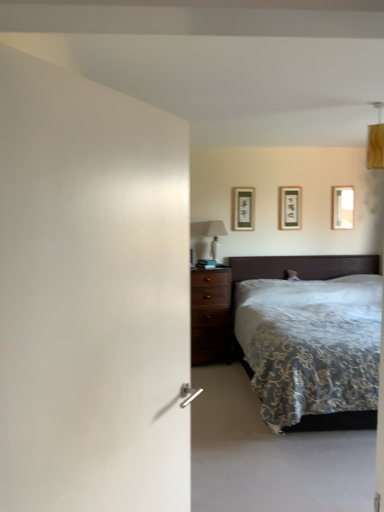
In order to face white glossy table lamp at upper center, should I rotate leftwards or rightwards?

Rotate right and turn 3.295 degrees.

Where is `white glossy table lamp at upper center`? white glossy table lamp at upper center is located at coordinates (210, 233).

Find the location of a particular element. Image resolution: width=384 pixels, height=512 pixels. wooden picture frame at upper right, acting as the first picture frame starting from the right is located at coordinates (342, 207).

Describe the element at coordinates (290, 208) in the screenshot. The image size is (384, 512). I see `matte black picture frame at upper center, the second picture frame in the left-to-right sequence` at that location.

This screenshot has width=384, height=512. What do you see at coordinates (297, 274) in the screenshot? I see `velvet dark brown bed at right` at bounding box center [297, 274].

This screenshot has height=512, width=384. What are the coordinates of `white glossy table lamp at upper center` in the screenshot? It's located at (210, 233).

Which is correct: matte black picture frame at upper center, the second picture frame in the left-to-right sequence, is inside matte black picture frame at upper center, the third picture frame in the right-to-left sequence, or outside of it?

matte black picture frame at upper center, the second picture frame in the left-to-right sequence, exists outside the volume of matte black picture frame at upper center, the third picture frame in the right-to-left sequence.

From the image's perspective, relative to matte black picture frame at upper center, which ranks as the first picture frame in left-to-right order, is matte black picture frame at upper center, the second picture frame in the left-to-right sequence, above or below?

Clearly, from the image's perspective, matte black picture frame at upper center, the second picture frame in the left-to-right sequence, is above matte black picture frame at upper center, which ranks as the first picture frame in left-to-right order.

Is matte black picture frame at upper center, the 2th picture frame positioned from the right, not near matte black picture frame at upper center, the third picture frame in the right-to-left sequence?

Actually, matte black picture frame at upper center, the 2th picture frame positioned from the right, and matte black picture frame at upper center, the third picture frame in the right-to-left sequence, are a little close together.

From a real-world perspective, which is physically above, matte black picture frame at upper center, the second picture frame in the left-to-right sequence, or matte black picture frame at upper center, the third picture frame in the right-to-left sequence?

matte black picture frame at upper center, the third picture frame in the right-to-left sequence, from a real-world perspective.

From the picture: Which object is thinner, wooden picture frame at upper right, which is counted as the 3th picture frame, starting from the left, or matte black picture frame at upper center, the third picture frame in the right-to-left sequence?

Thinner between the two is wooden picture frame at upper right, which is counted as the 3th picture frame, starting from the left.

Find the location of a particular element. This screenshot has width=384, height=512. the 2nd picture frame to the right of the matte black picture frame at upper center, the third picture frame in the right-to-left sequence, starting your count from the anchor is located at coordinates click(x=342, y=207).

Considering the sizes of objects wooden picture frame at upper right, which is counted as the 3th picture frame, starting from the left, and matte black picture frame at upper center, the third picture frame in the right-to-left sequence, in the image provided, who is bigger, wooden picture frame at upper right, which is counted as the 3th picture frame, starting from the left, or matte black picture frame at upper center, the third picture frame in the right-to-left sequence,?

matte black picture frame at upper center, the third picture frame in the right-to-left sequence, is bigger.

At what (x,y) coordinates should I click in order to perform the action: click on picture frame that is the 1st one when counting leftward from the velvet dark brown bed at right. Please return your answer as a coordinate pair (x, y). Image resolution: width=384 pixels, height=512 pixels. Looking at the image, I should click on (290, 208).

Is velvet dark brown bed at right far away from matte black picture frame at upper center, the 2th picture frame positioned from the right?

No, velvet dark brown bed at right is in close proximity to matte black picture frame at upper center, the 2th picture frame positioned from the right.

Which is in front, point (379, 259) or point (283, 210)?

The point (283, 210) is more forward.

Is velvet dark brown bed at right positioned with its back to matte black picture frame at upper center, the 2th picture frame positioned from the right?

No, velvet dark brown bed at right's orientation is not away from matte black picture frame at upper center, the 2th picture frame positioned from the right.

From the image's perspective, does matte black picture frame at upper center, the third picture frame in the right-to-left sequence, appear lower than wooden picture frame at upper right, which is counted as the 3th picture frame, starting from the left?

Yes, from the image's perspective, matte black picture frame at upper center, the third picture frame in the right-to-left sequence, is beneath wooden picture frame at upper right, which is counted as the 3th picture frame, starting from the left.

Based on their sizes in the image, would you say matte black picture frame at upper center, the third picture frame in the right-to-left sequence, is bigger or smaller than wooden picture frame at upper right, acting as the first picture frame starting from the right?

Considering their sizes, matte black picture frame at upper center, the third picture frame in the right-to-left sequence, takes up more space than wooden picture frame at upper right, acting as the first picture frame starting from the right.

Would you say matte black picture frame at upper center, which ranks as the first picture frame in left-to-right order, is inside or outside wooden picture frame at upper right, acting as the first picture frame starting from the right?

matte black picture frame at upper center, which ranks as the first picture frame in left-to-right order, is not enclosed by wooden picture frame at upper right, acting as the first picture frame starting from the right.

Relative to wooden picture frame at upper right, acting as the first picture frame starting from the right, is matte black picture frame at upper center, the third picture frame in the right-to-left sequence, in front or behind?

Visually, matte black picture frame at upper center, the third picture frame in the right-to-left sequence, is located in front of wooden picture frame at upper right, acting as the first picture frame starting from the right.

Is matte black picture frame at upper center, the third picture frame in the right-to-left sequence, to the left of matte black picture frame at upper center, the second picture frame in the left-to-right sequence, from the viewer's perspective?

Yes.

Is matte black picture frame at upper center, the third picture frame in the right-to-left sequence, spatially inside matte black picture frame at upper center, the 2th picture frame positioned from the right, or outside of it?

matte black picture frame at upper center, the third picture frame in the right-to-left sequence, is not enclosed by matte black picture frame at upper center, the 2th picture frame positioned from the right.

Is matte black picture frame at upper center, the third picture frame in the right-to-left sequence, turned away from matte black picture frame at upper center, the second picture frame in the left-to-right sequence?

No, matte black picture frame at upper center, the second picture frame in the left-to-right sequence, is not at the back of matte black picture frame at upper center, the third picture frame in the right-to-left sequence.

From the image's perspective, is matte black picture frame at upper center, which ranks as the first picture frame in left-to-right order, positioned above or below matte black picture frame at upper center, the 2th picture frame positioned from the right?

matte black picture frame at upper center, which ranks as the first picture frame in left-to-right order, is situated lower than matte black picture frame at upper center, the 2th picture frame positioned from the right, in the image.

How different are the orientations of matte black picture frame at upper center, the third picture frame in the right-to-left sequence, and velvet dark brown bed at right in degrees?

The angular difference between matte black picture frame at upper center, the third picture frame in the right-to-left sequence, and velvet dark brown bed at right is 0.00781 degrees.

Which object is closer to the camera, matte black picture frame at upper center, the third picture frame in the right-to-left sequence, or velvet dark brown bed at right?

velvet dark brown bed at right.

In order to click on bed to the right of matte black picture frame at upper center, the third picture frame in the right-to-left sequence in this screenshot , I will do `click(297, 274)`.

Between white glossy table lamp at upper center and matte black picture frame at upper center, which ranks as the first picture frame in left-to-right order, which one has smaller width?

With smaller width is matte black picture frame at upper center, which ranks as the first picture frame in left-to-right order.

Is white glossy table lamp at upper center positioned with its back to matte black picture frame at upper center, which ranks as the first picture frame in left-to-right order?

No, white glossy table lamp at upper center is not facing away from matte black picture frame at upper center, which ranks as the first picture frame in left-to-right order.

Can we say white glossy table lamp at upper center lies outside matte black picture frame at upper center, which ranks as the first picture frame in left-to-right order?

Indeed, white glossy table lamp at upper center is completely outside matte black picture frame at upper center, which ranks as the first picture frame in left-to-right order.

Can you confirm if white glossy table lamp at upper center is taller than matte black picture frame at upper center, which ranks as the first picture frame in left-to-right order?

Indeed, white glossy table lamp at upper center has a greater height compared to matte black picture frame at upper center, which ranks as the first picture frame in left-to-right order.

The width and height of the screenshot is (384, 512). I want to click on picture frame on the left side of matte black picture frame at upper center, the 2th picture frame positioned from the right, so click(243, 209).

At what (x,y) coordinates should I click in order to perform the action: click on the 2nd picture frame to the right when counting from the matte black picture frame at upper center, which ranks as the first picture frame in left-to-right order. Please return your answer as a coordinate pair (x, y). Image resolution: width=384 pixels, height=512 pixels. Looking at the image, I should click on (342, 207).

When comparing their distances from wooden picture frame at upper right, acting as the first picture frame starting from the right, does matte black picture frame at upper center, the second picture frame in the left-to-right sequence, or velvet dark brown bed at right seem further?

velvet dark brown bed at right.

From the image, which object appears to be farther from white glossy table lamp at upper center, matte black picture frame at upper center, the third picture frame in the right-to-left sequence, or matte black picture frame at upper center, the second picture frame in the left-to-right sequence?

matte black picture frame at upper center, the second picture frame in the left-to-right sequence.

Based on their spatial positions, is matte black picture frame at upper center, which ranks as the first picture frame in left-to-right order, or matte black picture frame at upper center, the second picture frame in the left-to-right sequence, further from wooden picture frame at upper right, acting as the first picture frame starting from the right?

Based on the image, matte black picture frame at upper center, which ranks as the first picture frame in left-to-right order, appears to be further to wooden picture frame at upper right, acting as the first picture frame starting from the right.

Based on the photo, estimate the real-world distances between objects in this image. Which object is closer to white glossy table lamp at upper center, matte black picture frame at upper center, the 2th picture frame positioned from the right, or matte black picture frame at upper center, which ranks as the first picture frame in left-to-right order?

Among the two, matte black picture frame at upper center, which ranks as the first picture frame in left-to-right order, is located nearer to white glossy table lamp at upper center.

Estimate the real-world distances between objects in this image. Which object is closer to wooden picture frame at upper right, which is counted as the 3th picture frame, starting from the left, velvet dark brown bed at right or matte black picture frame at upper center, the 2th picture frame positioned from the right?

Based on the image, matte black picture frame at upper center, the 2th picture frame positioned from the right, appears to be nearer to wooden picture frame at upper right, which is counted as the 3th picture frame, starting from the left.

Considering their positions, is matte black picture frame at upper center, which ranks as the first picture frame in left-to-right order, positioned closer to matte black picture frame at upper center, the 2th picture frame positioned from the right, than velvet dark brown bed at right?

matte black picture frame at upper center, which ranks as the first picture frame in left-to-right order, is positioned closer to the anchor matte black picture frame at upper center, the 2th picture frame positioned from the right.

Based on their spatial positions, is wooden picture frame at upper right, which is counted as the 3th picture frame, starting from the left, or velvet dark brown bed at right closer to matte black picture frame at upper center, which ranks as the first picture frame in left-to-right order?

velvet dark brown bed at right.

From the image, which object appears to be nearer to wooden picture frame at upper right, which is counted as the 3th picture frame, starting from the left, matte black picture frame at upper center, the third picture frame in the right-to-left sequence, or white glossy table lamp at upper center?

matte black picture frame at upper center, the third picture frame in the right-to-left sequence, lies closer to wooden picture frame at upper right, which is counted as the 3th picture frame, starting from the left, than the other object.

I want to click on table lamp between velvet dark brown bed at right and matte black picture frame at upper center, the second picture frame in the left-to-right sequence, along the z-axis, so click(210, 233).

In order to click on picture frame located between velvet dark brown bed at right and matte black picture frame at upper center, the second picture frame in the left-to-right sequence, in the depth direction in this screenshot , I will do `click(243, 209)`.

This screenshot has width=384, height=512. I want to click on picture frame situated between white glossy table lamp at upper center and matte black picture frame at upper center, the 2th picture frame positioned from the right, from left to right, so click(243, 209).

Identify the location of table lamp between velvet dark brown bed at right and wooden picture frame at upper right, which is counted as the 3th picture frame, starting from the left, along the z-axis. (210, 233).